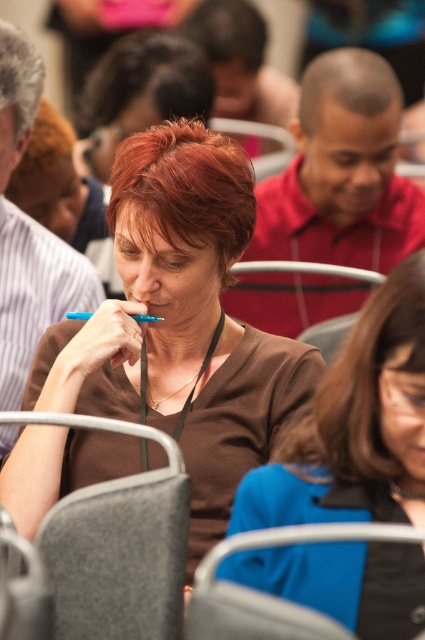
Question: Which of these objects is positioned farthest from the gray fabric chair at lower center?

Choices:
 (A) brown matte shirt at center
 (B) gray felt chair at center
 (C) matte brown shirt at center

Answer: (C)

Question: Which is farther from the brown matte shirt at center?

Choices:
 (A) matte brown shirt at center
 (B) gray fabric chair at lower center
 (C) gray felt chair at center

Answer: (A)

Question: Does brown matte shirt at center have a smaller size compared to gray fabric chair at lower center?

Choices:
 (A) no
 (B) yes

Answer: (A)

Question: Is brown matte shirt at center positioned behind gray fabric chair at lower center?

Choices:
 (A) no
 (B) yes

Answer: (B)

Question: Which object appears farthest from the camera in this image?

Choices:
 (A) brown matte shirt at center
 (B) gray felt chair at center

Answer: (B)

Question: Can you confirm if matte brown shirt at center is wider than brown matte shirt at center?

Choices:
 (A) no
 (B) yes

Answer: (B)